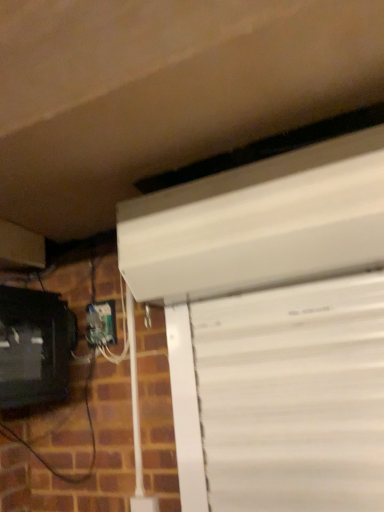
Question: Considering the relative sizes of white plastic electric outlet at lower left and matte black monitor at lower left in the image provided, is white plastic electric outlet at lower left wider than matte black monitor at lower left?

Choices:
 (A) no
 (B) yes

Answer: (A)

Question: Can you confirm if white plastic electric outlet at lower left is positioned to the right of matte black monitor at lower left?

Choices:
 (A) no
 (B) yes

Answer: (B)

Question: Is white plastic electric outlet at lower left completely or partially outside of matte black monitor at lower left?

Choices:
 (A) yes
 (B) no

Answer: (A)

Question: From a real-world perspective, is white plastic electric outlet at lower left physically above matte black monitor at lower left?

Choices:
 (A) yes
 (B) no

Answer: (A)

Question: Would you say white plastic electric outlet at lower left contains matte black monitor at lower left?

Choices:
 (A) no
 (B) yes

Answer: (A)

Question: Could you tell me if white plastic electric outlet at lower left is turned towards matte black monitor at lower left?

Choices:
 (A) yes
 (B) no

Answer: (A)

Question: Are matte black monitor at lower left and white plastic electric outlet at lower left making contact?

Choices:
 (A) yes
 (B) no

Answer: (B)

Question: Can you confirm if matte black monitor at lower left is thinner than white plastic electric outlet at lower left?

Choices:
 (A) yes
 (B) no

Answer: (B)

Question: Is matte black monitor at lower left positioned before white plastic electric outlet at lower left?

Choices:
 (A) no
 (B) yes

Answer: (B)

Question: From a real-world perspective, is matte black monitor at lower left physically above white plastic electric outlet at lower left?

Choices:
 (A) no
 (B) yes

Answer: (A)

Question: Is matte black monitor at lower left not within white plastic electric outlet at lower left?

Choices:
 (A) no
 (B) yes

Answer: (B)

Question: Does matte black monitor at lower left have a lesser height compared to white plastic electric outlet at lower left?

Choices:
 (A) yes
 (B) no

Answer: (B)

Question: Would you say matte black monitor at lower left is to the left or to the right of white plastic electric outlet at lower left in the picture?

Choices:
 (A) right
 (B) left

Answer: (B)